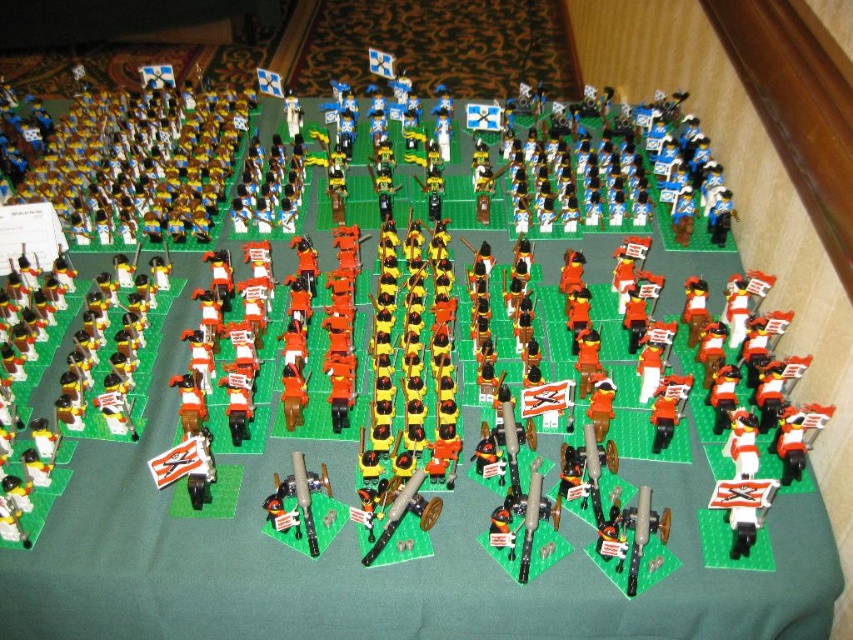
Who is shorter, wooden cannon at center or metallic cannon at center?

Standing shorter between the two is metallic cannon at center.

Is point (281, 532) in front of point (438, 509)?

Yes, point (281, 532) is closer to viewer.

In order to click on wooden cannon at center in this screenshot , I will do `click(296, 502)`.

Does metallic cannon at center appear under white matte flag at lower left?

Indeed, metallic cannon at center is positioned under white matte flag at lower left.

Between metallic cannon at center and white matte flag at lower left, which one has more height?

With more height is metallic cannon at center.

The width and height of the screenshot is (853, 640). What are the coordinates of `metallic cannon at center` in the screenshot? It's located at (405, 515).

Between wooden cannon at center and white matte flag at lower left, which one has less height?

Standing shorter between the two is white matte flag at lower left.

Does point (279, 484) come in front of point (160, 476)?

That is False.

Locate an element on the screen. The image size is (853, 640). wooden cannon at center is located at coordinates (296, 502).